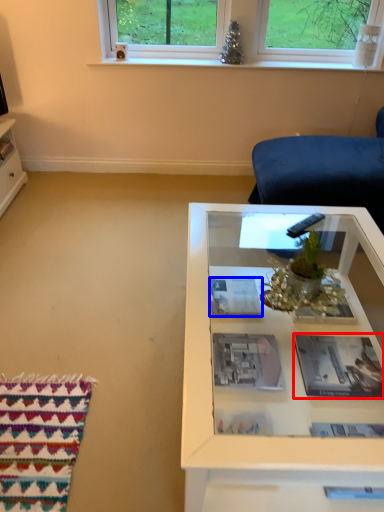
Question: Which point is closer to the camera, magazine (highlighted by a red box) or magazine (highlighted by a blue box)?

Choices:
 (A) magazine
 (B) magazine

Answer: (A)